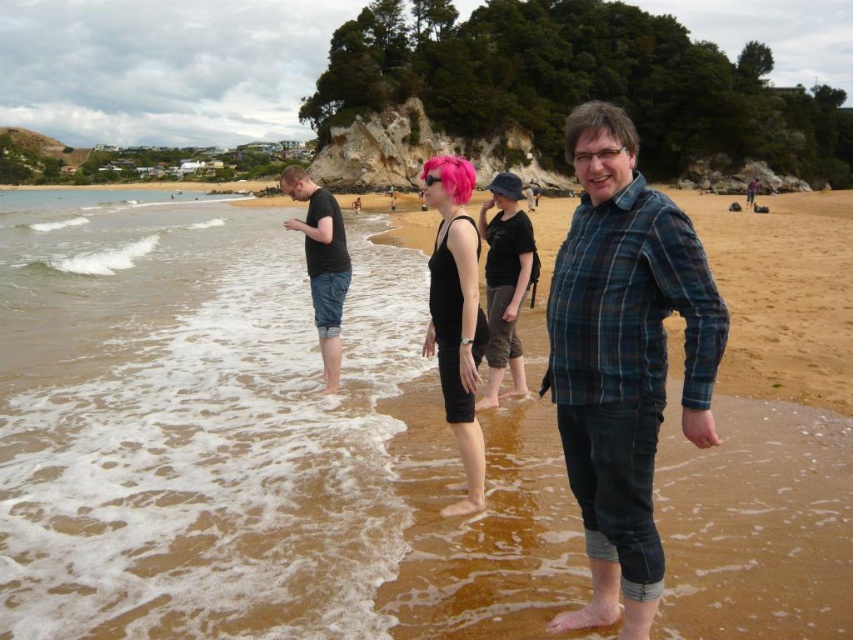
Measure the distance from plaid flannel shirt at center to black cotton shirt at left.

plaid flannel shirt at center and black cotton shirt at left are 14.02 meters apart.

Which is above, plaid flannel shirt at center or black cotton shirt at left?

black cotton shirt at left

Which is in front, point (628, 310) or point (337, 381)?

Point (628, 310) is more forward.

The width and height of the screenshot is (853, 640). Find the location of `plaid flannel shirt at center`. plaid flannel shirt at center is located at coordinates (624, 358).

Can you confirm if pink matte hair at center is thinner than black cotton shirt at left?

Correct, pink matte hair at center's width is less than black cotton shirt at left's.

Is point (456, 296) less distant than point (308, 202)?

Yes, point (456, 296) is in front of point (308, 202).

Find the location of a particular element. The image size is (853, 640). pink matte hair at center is located at coordinates (456, 314).

Can you confirm if brown sandy water at lower left is wider than black cotton shirt at left?

Yes.

Is the position of brown sandy water at lower left more distant than that of black cotton shirt at left?

No, brown sandy water at lower left is in front of black cotton shirt at left.

Is point (289, 252) less distant than point (338, 346)?

No, it is behind (338, 346).

Image resolution: width=853 pixels, height=640 pixels. I want to click on brown sandy water at lower left, so click(x=192, y=422).